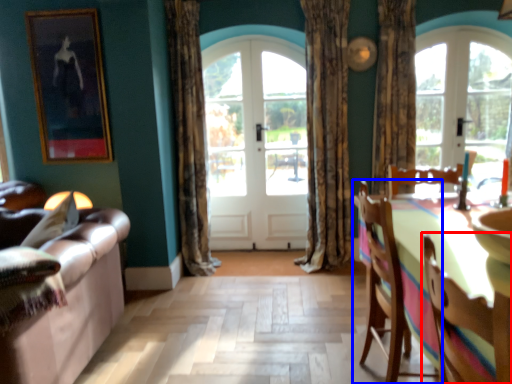
Question: Which object appears farthest to the camera in this image, chair (highlighted by a red box) or chair (highlighted by a blue box)?

Choices:
 (A) chair
 (B) chair

Answer: (B)